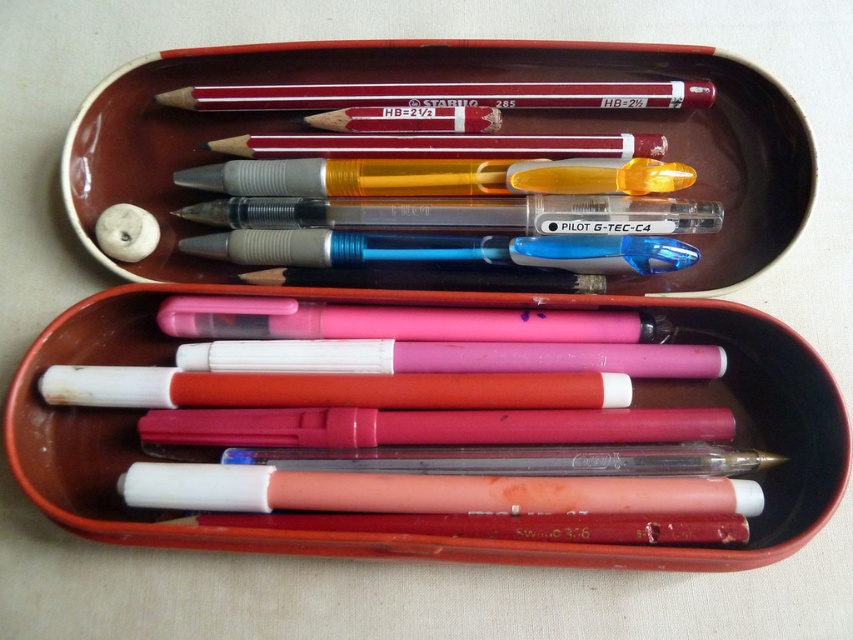
Looking at this image, you are organizing stationery and need to place the matte red pencil at upper center and the white matte eraser at upper left into a drawer. The drawer has a height limit of 5 cm. Can both items fit vertically without bending?

The matte red pencil at upper center is larger in size than the white matte eraser at upper left. Since the drawer has a height limit of 5 cm, we need to check if the pencil is under 5 cm. However, the exact dimensions aren

You are looking into the open pencil case and see two points marked inside it. The first point is at coordinates point (485, 93) and the second is at point (119, 241). Which point is closer to you?

Point (485, 93) is closer to you because it is further to the viewer than point (119, 241).